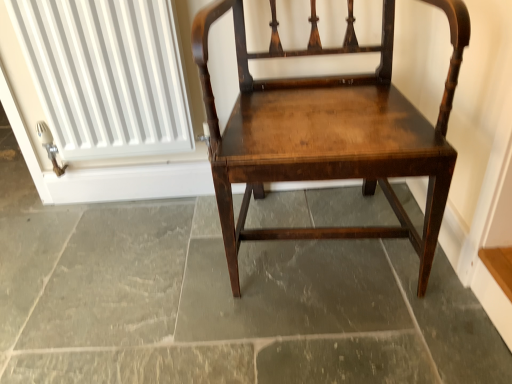
Question: Is dark gray stone floor at center taller than white ribbed radiator at upper left?

Choices:
 (A) no
 (B) yes

Answer: (A)

Question: Is dark gray stone floor at center wider than white ribbed radiator at upper left?

Choices:
 (A) yes
 (B) no

Answer: (A)

Question: Is dark gray stone floor at center positioned beyond the bounds of white ribbed radiator at upper left?

Choices:
 (A) no
 (B) yes

Answer: (B)

Question: Considering the relative positions of dark gray stone floor at center and white ribbed radiator at upper left in the image provided, is dark gray stone floor at center to the left of white ribbed radiator at upper left from the viewer's perspective?

Choices:
 (A) yes
 (B) no

Answer: (B)

Question: Is there a large distance between dark gray stone floor at center and white ribbed radiator at upper left?

Choices:
 (A) yes
 (B) no

Answer: (B)

Question: Is dark gray stone floor at center smaller than white ribbed radiator at upper left?

Choices:
 (A) yes
 (B) no

Answer: (B)

Question: From the image's perspective, is shiny dark wood chair at center under white ribbed radiator at upper left?

Choices:
 (A) yes
 (B) no

Answer: (A)

Question: Does shiny dark wood chair at center have a larger size compared to white ribbed radiator at upper left?

Choices:
 (A) no
 (B) yes

Answer: (B)

Question: Is shiny dark wood chair at center wider than white ribbed radiator at upper left?

Choices:
 (A) no
 (B) yes

Answer: (B)

Question: From the image's perspective, is shiny dark wood chair at center on top of white ribbed radiator at upper left?

Choices:
 (A) no
 (B) yes

Answer: (A)

Question: Is white ribbed radiator at upper left a part of shiny dark wood chair at center?

Choices:
 (A) yes
 (B) no

Answer: (B)

Question: Would you consider shiny dark wood chair at center to be distant from white ribbed radiator at upper left?

Choices:
 (A) no
 (B) yes

Answer: (A)

Question: Does dark gray stone floor at center have a lesser height compared to shiny dark wood chair at center?

Choices:
 (A) yes
 (B) no

Answer: (A)